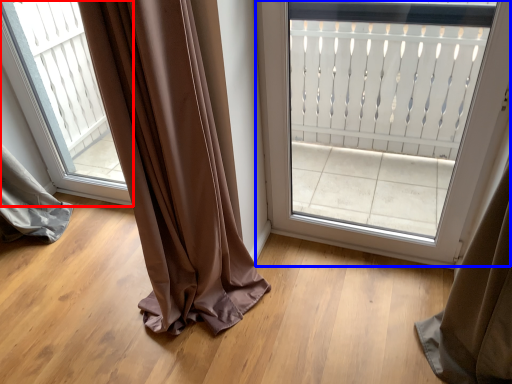
Question: Which of the following is the farthest to the observer, window (highlighted by a red box) or door (highlighted by a blue box)?

Choices:
 (A) window
 (B) door

Answer: (A)